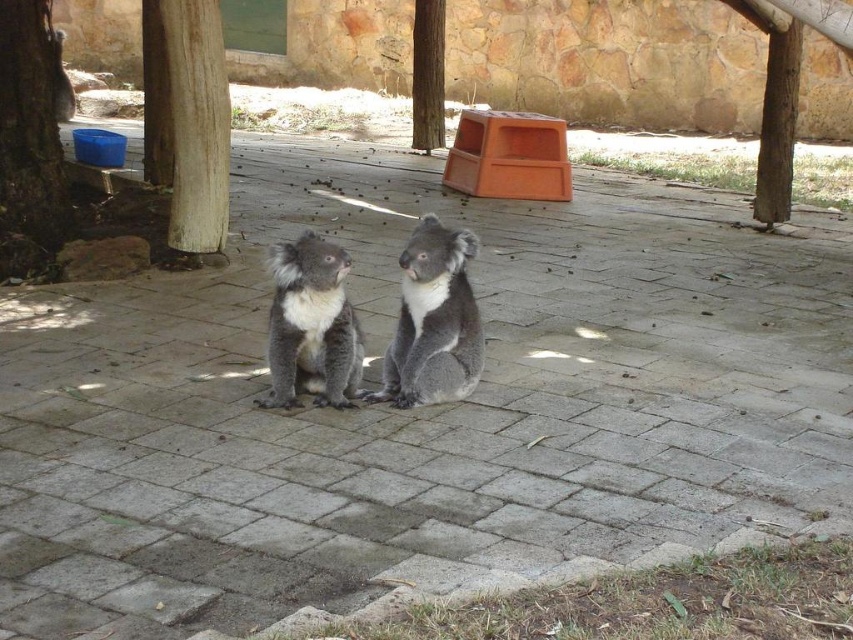
The image size is (853, 640). What do you see at coordinates (433, 321) in the screenshot? I see `gray furry koala at center` at bounding box center [433, 321].

In the scene shown: Does gray furry koala at center appear under brown textured wood at left?

Yes.

Is point (399, 262) in front of point (183, 209)?

Yes, point (399, 262) is in front of point (183, 209).

This screenshot has width=853, height=640. I want to click on gray furry koala at center, so click(433, 321).

Who is lower down, brown textured wood at left or fuzzy gray koala at upper center?

brown textured wood at left

Between point (189, 148) and point (59, 104), which one is positioned in front?

Point (189, 148) is more forward.

The image size is (853, 640). Find the location of `brown textured wood at left`. brown textured wood at left is located at coordinates (196, 124).

Which is more to the right, brown textured wood at left or smooth brown tree trunk at center?

Positioned to the right is smooth brown tree trunk at center.

Does brown textured wood at left have a larger size compared to smooth brown tree trunk at center?

Actually, brown textured wood at left might be smaller than smooth brown tree trunk at center.

Which is behind, point (183, 157) or point (439, 26)?

Point (439, 26)

Locate an element on the screen. brown textured wood at left is located at coordinates (196, 124).